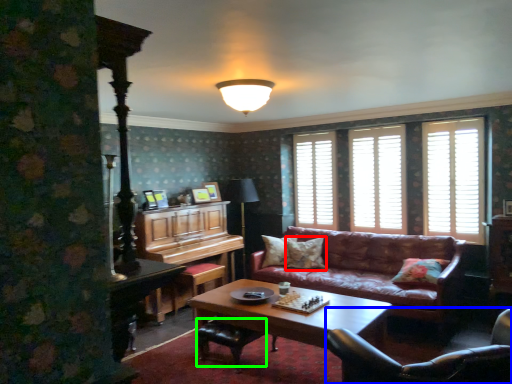
Question: Considering the real-world distances, which object is closest to pillow (highlighted by a red box)? chair (highlighted by a blue box) or footrest (highlighted by a green box).

Choices:
 (A) chair
 (B) footrest

Answer: (B)